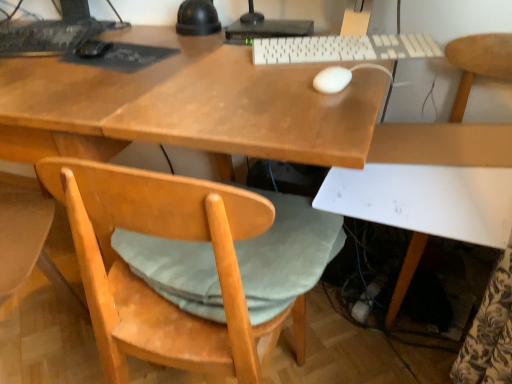
Measure the distance between point (152, 61) and camera.

A distance of 38.74 inches exists between point (152, 61) and camera.

This screenshot has height=384, width=512. In order to click on dark gray matte mousepad at upper left in this screenshot , I will do pos(119,55).

Describe the element at coordinates (187, 263) in the screenshot. I see `light wood/rough chair at lower left` at that location.

Measure the distance between point (332, 90) and camera.

The depth of point (332, 90) is 30.59 inches.

What is the approximate width of white matte mouse at center, which is the second mouse in top-to-bottom order?

4.26 inches.

Find the location of a particular element. This screenshot has height=384, width=512. dark gray matte mousepad at upper left is located at coordinates (119, 55).

From a real-world perspective, between white plastic desktop computer at upper center and white plastic keyboard at center, which is the second computer keyboard in left-to-right order, who is vertically lower?

white plastic keyboard at center, which is the second computer keyboard in left-to-right order.

How different are the orientations of white plastic desktop computer at upper center and white plastic keyboard at center, the 2th computer keyboard in the back-to-front sequence, in degrees?

There is a 19.2-degree angle between the facing directions of white plastic desktop computer at upper center and white plastic keyboard at center, the 2th computer keyboard in the back-to-front sequence.

From the image's perspective, relative to white plastic keyboard at center, which is the second computer keyboard in left-to-right order, is white plastic desktop computer at upper center above or below?

From the image's perspective, white plastic desktop computer at upper center appears above white plastic keyboard at center, which is the second computer keyboard in left-to-right order.

Considering the relative sizes of white plastic desktop computer at upper center and white plastic keyboard at center, the first computer keyboard in the right-to-left sequence, in the image provided, is white plastic desktop computer at upper center shorter than white plastic keyboard at center, the first computer keyboard in the right-to-left sequence,?

No.

Are black matte keyboard at upper left, placed as the first computer keyboard when sorted from back to front, and dark gray matte mousepad at upper left making contact?

No, black matte keyboard at upper left, placed as the first computer keyboard when sorted from back to front, is not next to dark gray matte mousepad at upper left.

Between point (50, 55) and point (148, 51), which one is positioned in front?

Point (50, 55)

Considering the sizes of black matte keyboard at upper left, the first computer keyboard when ordered from left to right, and dark gray matte mousepad at upper left in the image, is black matte keyboard at upper left, the first computer keyboard when ordered from left to right, taller or shorter than dark gray matte mousepad at upper left?

In the image, black matte keyboard at upper left, the first computer keyboard when ordered from left to right, appears to be taller than dark gray matte mousepad at upper left.

From the image's perspective, is black matte keyboard at upper left, the second computer keyboard from the right, over dark gray matte mousepad at upper left?

Indeed, from the image's perspective, black matte keyboard at upper left, the second computer keyboard from the right, is shown above dark gray matte mousepad at upper left.

Is white plastic desktop computer at upper center wider than dark gray matte mousepad at upper left?

No, white plastic desktop computer at upper center is not wider than dark gray matte mousepad at upper left.

Are white plastic desktop computer at upper center and dark gray matte mousepad at upper left located far from each other?

Actually, white plastic desktop computer at upper center and dark gray matte mousepad at upper left are a little close together.

Which is closer to the camera, [310,20] or [97,40]?

The point [97,40] is closer to the camera.

Which of these two, white matte mouse at center, which ranks as the 2th mouse in left-to-right order, or dark gray matte mousepad at upper left, is bigger?

dark gray matte mousepad at upper left is bigger.

Is white matte mouse at center, which is the second mouse in top-to-bottom order, looking in the opposite direction of dark gray matte mousepad at upper left?

No.

Which is less distant, (315, 76) or (142, 56)?

The point (315, 76) is closer.

Would you say white matte mouse at center, the 1th mouse when ordered from right to left, is to the left or to the right of dark gray matte mousepad at upper left in the picture?

white matte mouse at center, the 1th mouse when ordered from right to left, is positioned on dark gray matte mousepad at upper left's right side.

Is white matte mouse at center, which ranks as the 2th mouse in left-to-right order, facing away from black matte mouse at upper left, positioned as the first mouse in back-to-front order?

That's not correct — white matte mouse at center, which ranks as the 2th mouse in left-to-right order, is not looking away from black matte mouse at upper left, positioned as the first mouse in back-to-front order.

Can you confirm if white matte mouse at center, which ranks as the 2th mouse in left-to-right order, is shorter than black matte mouse at upper left, which appears as the 2th mouse when viewed from the right?

Indeed, white matte mouse at center, which ranks as the 2th mouse in left-to-right order, has a lesser height compared to black matte mouse at upper left, which appears as the 2th mouse when viewed from the right.

Is white matte mouse at center, the 1th mouse when ordered from right to left, wider than black matte mouse at upper left, arranged as the 1th mouse when viewed from the left?

No.

Considering the sizes of objects white matte mouse at center, which is the second mouse in top-to-bottom order, and black matte mouse at upper left, which appears as the 2th mouse when viewed from the right, in the image provided, who is bigger, white matte mouse at center, which is the second mouse in top-to-bottom order, or black matte mouse at upper left, which appears as the 2th mouse when viewed from the right,?

black matte mouse at upper left, which appears as the 2th mouse when viewed from the right.

What are the coordinates of `computer keyboard that is on the right side of light wood/rough chair at lower left` in the screenshot? It's located at (343, 48).

Consider the image. From a real-world perspective, is white plastic keyboard at center, which is the second computer keyboard in left-to-right order, located beneath light wood/rough chair at lower left?

No, from a real-world perspective, white plastic keyboard at center, which is the second computer keyboard in left-to-right order, is not beneath light wood/rough chair at lower left.

Looking at this image, is white plastic keyboard at center, the 2th computer keyboard in the back-to-front sequence, next to light wood/rough chair at lower left and touching it?

No, white plastic keyboard at center, the 2th computer keyboard in the back-to-front sequence, is not with light wood/rough chair at lower left.

Is white plastic keyboard at center, the 2th computer keyboard in the back-to-front sequence, taller or shorter than light wood/rough chair at lower left?

white plastic keyboard at center, the 2th computer keyboard in the back-to-front sequence, is shorter than light wood/rough chair at lower left.

Is white matte chair at lower right to the right of light wood/rough chair at lower left from the viewer's perspective?

Yes, white matte chair at lower right is to the right of light wood/rough chair at lower left.

Is the surface of white matte chair at lower right in direct contact with light wood/rough chair at lower left?

There is a gap between white matte chair at lower right and light wood/rough chair at lower left.

Which object is closer to the camera, white matte chair at lower right or light wood/rough chair at lower left?

white matte chair at lower right is in front.

Find the location of a particular element. This screenshot has width=512, height=384. desktop computer that appears above the white plastic keyboard at center, which is the second computer keyboard in left-to-right order (from a real-world perspective) is located at coordinates (264, 28).

The height and width of the screenshot is (384, 512). Identify the location of computer keyboard located above the dark gray matte mousepad at upper left (from the image's perspective). (45, 37).

Which object lies nearer to the anchor point black matte mouse at upper left, which ranks as the second mouse in front-to-back order, dark gray matte mousepad at upper left or white matte mouse at center, the 1th mouse when ordered from right to left?

dark gray matte mousepad at upper left is positioned closer to the anchor black matte mouse at upper left, which ranks as the second mouse in front-to-back order.

Estimate the real-world distances between objects in this image. Which object is closer to white plastic desktop computer at upper center, white matte chair at lower right or black matte mouse at upper left, which appears as the 2th mouse when viewed from the right?

The object closer to white plastic desktop computer at upper center is black matte mouse at upper left, which appears as the 2th mouse when viewed from the right.

From the image, which object appears to be nearer to white matte mouse at center, which is the second mouse in top-to-bottom order, black matte keyboard at upper left, placed as the first computer keyboard when sorted from back to front, or white plastic keyboard at center, the 1th computer keyboard when ordered from front to back?

white plastic keyboard at center, the 1th computer keyboard when ordered from front to back.

When comparing their distances from black matte mouse at upper left, which appears as the 2th mouse when viewed from the right, does dark gray matte mousepad at upper left or white plastic desktop computer at upper center seem closer?

The object closer to black matte mouse at upper left, which appears as the 2th mouse when viewed from the right, is dark gray matte mousepad at upper left.

Considering their positions, is white matte mouse at center, which is the 2th mouse from back to front, positioned further to white matte chair at lower right than black matte mouse at upper left, which ranks as the first mouse in top-to-bottom order?

black matte mouse at upper left, which ranks as the first mouse in top-to-bottom order, is further to white matte chair at lower right.

Considering their positions, is white plastic desktop computer at upper center positioned closer to light wood/rough chair at lower left than white matte mouse at center, which ranks as the 2th mouse in left-to-right order?

white matte mouse at center, which ranks as the 2th mouse in left-to-right order.

Considering their positions, is white matte chair at lower right positioned further to black matte mouse at upper left, arranged as the 1th mouse when viewed from the left, than white plastic desktop computer at upper center?

white matte chair at lower right lies further to black matte mouse at upper left, arranged as the 1th mouse when viewed from the left, than the other object.

Considering their positions, is white plastic keyboard at center, the first computer keyboard in the right-to-left sequence, positioned further to black matte keyboard at upper left, the first computer keyboard when ordered from left to right, than light wood/rough chair at lower left?

Based on the image, light wood/rough chair at lower left appears to be further to black matte keyboard at upper left, the first computer keyboard when ordered from left to right.

This screenshot has height=384, width=512. In order to click on mouse between black matte keyboard at upper left, the second computer keyboard positioned from the front, and light wood/rough chair at lower left, in the horizontal direction in this screenshot , I will do `click(93, 49)`.

Locate an element on the screen. This screenshot has width=512, height=384. mouse between dark gray matte mousepad at upper left and white plastic keyboard at center, the first computer keyboard in the right-to-left sequence, in the horizontal direction is located at coordinates (332, 79).

The height and width of the screenshot is (384, 512). I want to click on chair situated between black matte mouse at upper left, arranged as the 1th mouse when viewed from the left, and white plastic keyboard at center, the 1th computer keyboard when ordered from front to back, from left to right, so click(187, 263).

The height and width of the screenshot is (384, 512). I want to click on desktop computer between dark gray matte mousepad at upper left and white plastic keyboard at center, the first computer keyboard in the right-to-left sequence, so click(x=264, y=28).